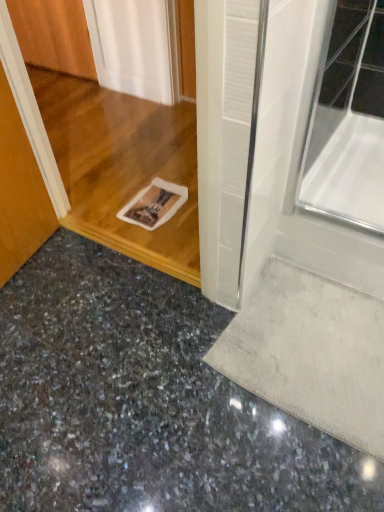
The image size is (384, 512). I want to click on vacant point above polished granite floor at lower left (from a real-world perspective), so click(x=134, y=386).